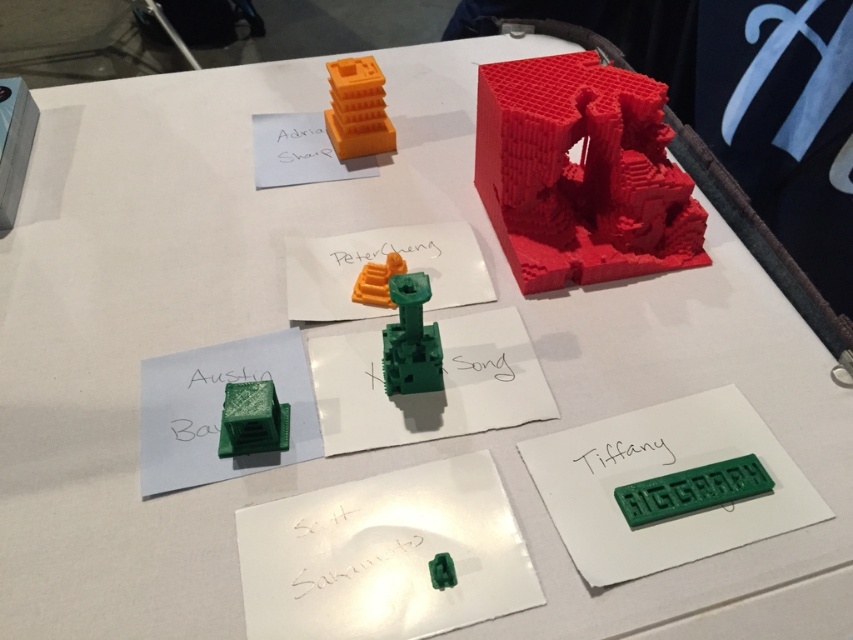
Question: Which point is farther from the camera taking this photo?

Choices:
 (A) (276, 412)
 (B) (399, 355)

Answer: (B)

Question: Is red matte sculpture at upper right wider than green matte block at lower left?

Choices:
 (A) no
 (B) yes

Answer: (B)

Question: Does green matte tower at center have a greater width compared to orange matte toy at center?

Choices:
 (A) yes
 (B) no

Answer: (A)

Question: Which point is farther to the camera?

Choices:
 (A) orange matte tower at upper center
 (B) orange matte toy at center
 (C) green matte tower at center
 (D) green matte lettering at lower right

Answer: (A)

Question: From the image, what is the correct spatial relationship of green matte tower at center in relation to orange matte tower at upper center?

Choices:
 (A) below
 (B) above

Answer: (A)

Question: Which object is closer to the camera taking this photo?

Choices:
 (A) orange matte tower at upper center
 (B) green matte tower at center

Answer: (B)